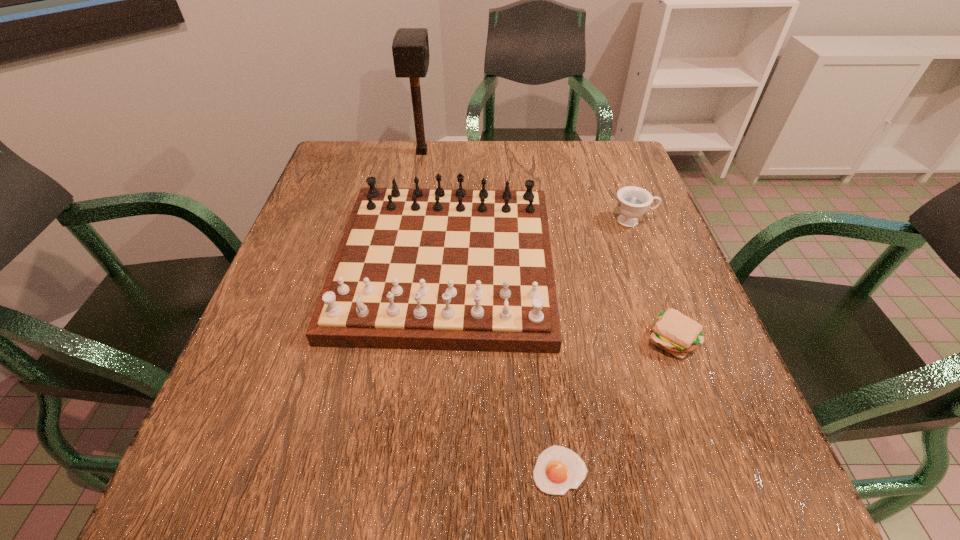
This screenshot has height=540, width=960. What are the coordinates of `blank area at the far left corner` in the screenshot? It's located at (359, 145).

The image size is (960, 540). In order to click on free space at the near left corner in this screenshot , I will do `click(276, 508)`.

In the image, there is a desktop. Identify the location of vacant space at the far right corner. (608, 159).

Where is `vacant area that lies between the teacup and the egg yolk`? This screenshot has width=960, height=540. vacant area that lies between the teacup and the egg yolk is located at coordinates (596, 346).

Where is `vacant area between the teacup and the fourth tallest object`? This screenshot has height=540, width=960. vacant area between the teacup and the fourth tallest object is located at coordinates (652, 280).

Locate an element on the screen. This screenshot has width=960, height=540. free point between the teacup and the nearest object is located at coordinates (596, 346).

Find the location of a particular element. The image size is (960, 540). free space between the shortest object and the chessboard is located at coordinates (502, 367).

Identify the location of empty space between the teacup and the nearest object. (596, 346).

At what (x,y) coordinates should I click in order to perform the action: click on object that stands as the fourth closest to the second tallest object. Please return your answer as a coordinate pair (x, y). This screenshot has height=540, width=960. Looking at the image, I should click on (558, 469).

You are a GUI agent. You are given a task and a screenshot of the screen. Output one action in this format:
    pyautogui.click(x=<x>, y=<y>)
    Task: Click on the object that is the closest to the third shortest object
    Image resolution: width=960 pixels, height=540 pixels.
    Given the screenshot: What is the action you would take?
    pyautogui.click(x=460, y=269)